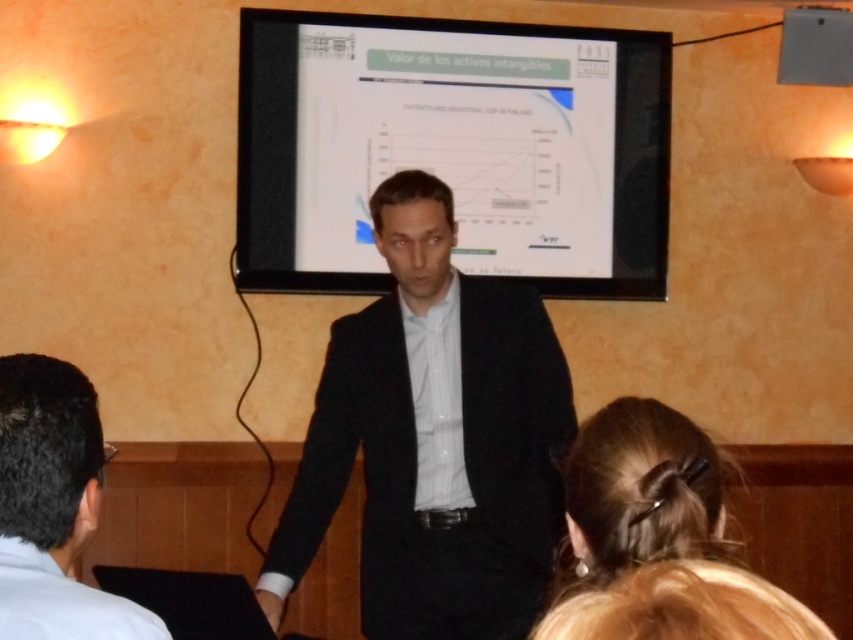
Who is lower down, blonde hair at lower right or matte black laptop at upper center?

blonde hair at lower right is lower down.

Who is more distant from viewer, [659,433] or [782,42]?

The point [782,42] is behind.

Between point (592, 564) and point (804, 68), which one is positioned behind?

Positioned behind is point (804, 68).

You are a GUI agent. You are given a task and a screenshot of the screen. Output one action in this format:
    pyautogui.click(x=<x>, y=<y>)
    Task: Click on the blonde hair at lower right
    This screenshot has height=640, width=853.
    Given the screenshot: What is the action you would take?
    pyautogui.click(x=637, y=493)

Can you confirm if matte black screen at center is positioned above matte black laptop at upper center?

Actually, matte black screen at center is below matte black laptop at upper center.

I want to click on matte black screen at center, so click(x=453, y=148).

At what (x,y) coordinates should I click in order to perform the action: click on matte black screen at center. Please return your answer as a coordinate pair (x, y). This screenshot has height=640, width=853. Looking at the image, I should click on (453, 148).

Who is taller, black wool suit at center or blonde hair at lower right?

With more height is black wool suit at center.

Does black wool suit at center have a greater width compared to blonde hair at lower right?

Indeed, black wool suit at center has a greater width compared to blonde hair at lower right.

Does point (448, 605) come farther from viewer compared to point (720, 468)?

Yes, point (448, 605) is farther from viewer.

Where is `black wool suit at center`? black wool suit at center is located at coordinates (434, 440).